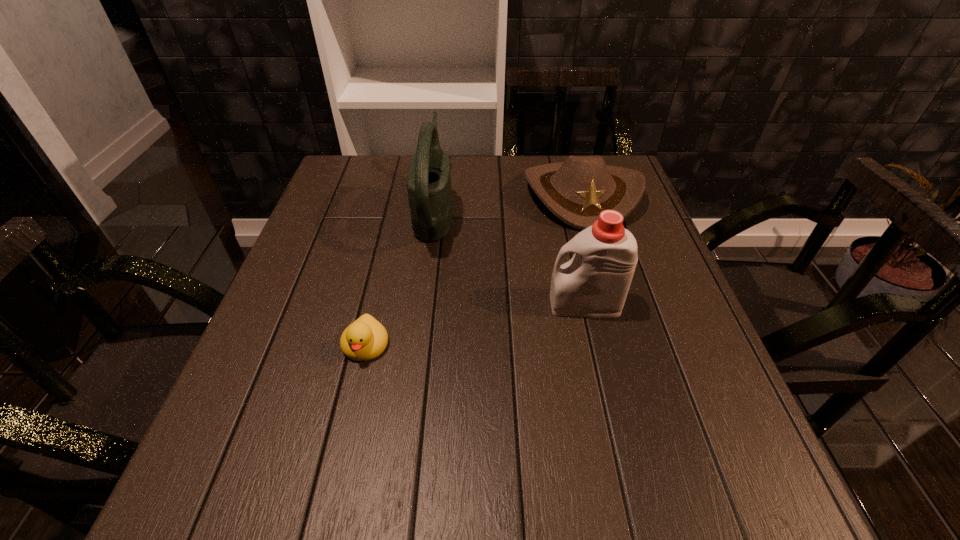
The image size is (960, 540). I want to click on vacant region located on the face of the duckling, so click(348, 418).

Locate an element on the screen. The width and height of the screenshot is (960, 540). watering can located in the far edge section of the desktop is located at coordinates (428, 183).

Identify the location of cowboy hat present at the far edge. The image size is (960, 540). (576, 191).

At what (x,y) coordinates should I click in order to perform the action: click on detergent located in the right edge section of the desktop. Please return your answer as a coordinate pair (x, y). Looking at the image, I should click on (594, 284).

Where is `cowboy hat that is at the right edge`? The height and width of the screenshot is (540, 960). cowboy hat that is at the right edge is located at coordinates (576, 191).

The image size is (960, 540). What are the coordinates of `object present at the far right corner` in the screenshot? It's located at (576, 191).

I want to click on vacant space at the far edge of the desktop, so click(x=530, y=167).

Find the location of a particular element. vacant area at the near edge of the desktop is located at coordinates (552, 477).

I want to click on vacant space at the left edge, so click(240, 403).

This screenshot has width=960, height=540. Identify the location of vacant space at the right edge of the desktop. pos(726,390).